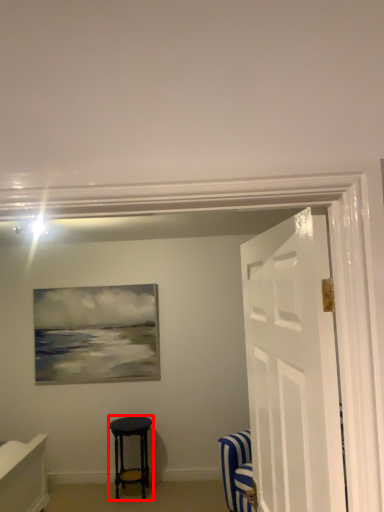
Question: From the image's perspective, considering the relative positions of stool (annotated by the red box) and door in the image provided, where is stool (annotated by the red box) located with respect to the staircase?

Choices:
 (A) above
 (B) below

Answer: (B)